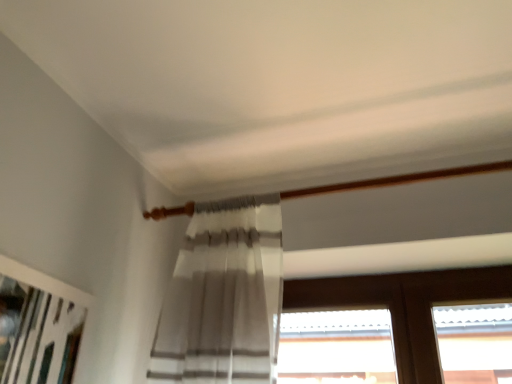
What is the approximate height of sheer white curtain at upper center?

sheer white curtain at upper center is 20.11 inches in height.

The image size is (512, 384). In order to click on sheer white curtain at upper center in this screenshot , I will do `click(223, 297)`.

The image size is (512, 384). What do you see at coordinates (223, 297) in the screenshot?
I see `sheer white curtain at upper center` at bounding box center [223, 297].

Where is `sheer white curtain at upper center`? sheer white curtain at upper center is located at coordinates (223, 297).